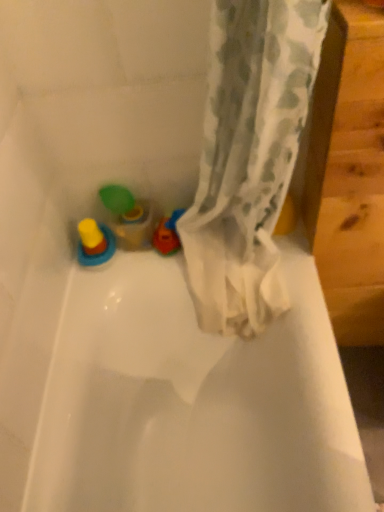
Question: From the image's perspective, is yellow rubber ring at lower left, which appears as the 2th toy when viewed from the right, beneath translucent plastic cup at left, which appears as the second toy when viewed from the left?

Choices:
 (A) yes
 (B) no

Answer: (A)

Question: Does yellow rubber ring at lower left, which appears as the 2th toy when viewed from the right, turn towards translucent plastic cup at left, which appears as the second toy when viewed from the left?

Choices:
 (A) no
 (B) yes

Answer: (A)

Question: Considering the relative sizes of yellow rubber ring at lower left, which appears as the 2th toy when viewed from the right, and translucent plastic cup at left, which appears as the second toy when viewed from the left, in the image provided, is yellow rubber ring at lower left, which appears as the 2th toy when viewed from the right, bigger than translucent plastic cup at left, which appears as the second toy when viewed from the left,?

Choices:
 (A) yes
 (B) no

Answer: (B)

Question: Does yellow rubber ring at lower left, which is the 1th toy in left-to-right order, have a lesser width compared to translucent plastic cup at left, which appears as the second toy when viewed from the left?

Choices:
 (A) no
 (B) yes

Answer: (A)

Question: Can you confirm if yellow rubber ring at lower left, which is the 1th toy in left-to-right order, is shorter than translucent plastic cup at left, which appears as the second toy when viewed from the left?

Choices:
 (A) yes
 (B) no

Answer: (A)

Question: Does yellow rubber ring at lower left, which is the 1th toy in left-to-right order, contain translucent plastic cup at left, which is counted as the first toy, starting from the right?

Choices:
 (A) yes
 (B) no

Answer: (B)

Question: Is the depth of translucent plastic cup at left, which appears as the second toy when viewed from the left, less than that of yellow rubber ring at lower left, which appears as the 2th toy when viewed from the right?

Choices:
 (A) yes
 (B) no

Answer: (B)

Question: Does translucent plastic cup at left, which is counted as the first toy, starting from the right, touch yellow rubber ring at lower left, which is the 1th toy in left-to-right order?

Choices:
 (A) no
 (B) yes

Answer: (B)

Question: Considering the relative sizes of translucent plastic cup at left, which appears as the second toy when viewed from the left, and yellow rubber ring at lower left, which is the 1th toy in left-to-right order, in the image provided, is translucent plastic cup at left, which appears as the second toy when viewed from the left, shorter than yellow rubber ring at lower left, which is the 1th toy in left-to-right order,?

Choices:
 (A) yes
 (B) no

Answer: (B)

Question: From the image's perspective, does translucent plastic cup at left, which is counted as the first toy, starting from the right, appear lower than yellow rubber ring at lower left, which appears as the 2th toy when viewed from the right?

Choices:
 (A) no
 (B) yes

Answer: (A)

Question: Does translucent plastic cup at left, which appears as the second toy when viewed from the left, appear on the left side of yellow rubber ring at lower left, which appears as the 2th toy when viewed from the right?

Choices:
 (A) yes
 (B) no

Answer: (B)

Question: Is yellow rubber ring at lower left, which appears as the 2th toy when viewed from the right, a part of translucent plastic cup at left, which is counted as the first toy, starting from the right?

Choices:
 (A) no
 (B) yes

Answer: (A)

Question: From the image's perspective, is yellow rubber ring at lower left, which appears as the 2th toy when viewed from the right, positioned above or below translucent plastic cup at left, which is counted as the first toy, starting from the right?

Choices:
 (A) above
 (B) below

Answer: (B)